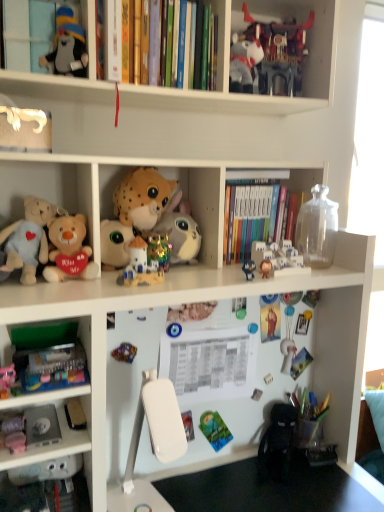
Question: From a real-world perspective, does soft plush toy at center, which is counted as the 1th cabinet, starting from the bottom, stand above soft plush toys at left, the 1th shelf ordered from the bottom?

Choices:
 (A) no
 (B) yes

Answer: (B)

Question: Can you confirm if soft plush toy at center, which is the 1th cabinet in right-to-left order, is shorter than soft plush toys at left, the 1th shelf ordered from the bottom?

Choices:
 (A) yes
 (B) no

Answer: (A)

Question: Is soft plush toy at center, which is counted as the 1th cabinet, starting from the bottom, outside soft plush toys at left, acting as the second shelf starting from the top?

Choices:
 (A) yes
 (B) no

Answer: (A)

Question: Considering the relative sizes of soft plush toy at center, which is counted as the 1th cabinet, starting from the bottom, and soft plush toys at left, the 1th shelf ordered from the bottom, in the image provided, is soft plush toy at center, which is counted as the 1th cabinet, starting from the bottom, taller than soft plush toys at left, the 1th shelf ordered from the bottom,?

Choices:
 (A) no
 (B) yes

Answer: (A)

Question: Can you confirm if soft plush toy at center, which is counted as the 1th cabinet, starting from the bottom, is wider than soft plush toys at left, acting as the second shelf starting from the top?

Choices:
 (A) no
 (B) yes

Answer: (B)

Question: Can you confirm if soft plush toy at center, the 2th cabinet when ordered from top to bottom, is thinner than soft plush toys at left, acting as the second shelf starting from the top?

Choices:
 (A) no
 (B) yes

Answer: (A)

Question: From the image's perspective, is matte pink plush at lower left, marked as the 9th toy in a top-to-bottom arrangement, on top of white plastic castle at upper center, which ranks as the fifth toy in top-to-bottom order?

Choices:
 (A) no
 (B) yes

Answer: (A)

Question: Can you confirm if matte pink plush at lower left, arranged as the 1th toy when ordered from the bottom, is positioned to the left of white plastic castle at upper center, marked as the fifth toy in a bottom-to-top arrangement?

Choices:
 (A) yes
 (B) no

Answer: (A)

Question: Is matte pink plush at lower left, marked as the 9th toy in a top-to-bottom arrangement, facing towards white plastic castle at upper center, marked as the fifth toy in a bottom-to-top arrangement?

Choices:
 (A) yes
 (B) no

Answer: (B)

Question: Does matte pink plush at lower left, marked as the 9th toy in a top-to-bottom arrangement, have a greater width compared to white plastic castle at upper center, marked as the fifth toy in a bottom-to-top arrangement?

Choices:
 (A) no
 (B) yes

Answer: (A)

Question: Considering the relative positions of matte pink plush at lower left, marked as the 9th toy in a top-to-bottom arrangement, and white plastic castle at upper center, marked as the fifth toy in a bottom-to-top arrangement, in the image provided, is matte pink plush at lower left, marked as the 9th toy in a top-to-bottom arrangement, to the right of white plastic castle at upper center, marked as the fifth toy in a bottom-to-top arrangement, from the viewer's perspective?

Choices:
 (A) yes
 (B) no

Answer: (B)

Question: Is white plastic castle at upper center, marked as the fifth toy in a bottom-to-top arrangement, inside matte pink plush at lower left, arranged as the 1th toy when ordered from the bottom?

Choices:
 (A) no
 (B) yes

Answer: (A)

Question: Can you confirm if white plastic table at lower center is positioned to the right of hardcover books at center, arranged as the 1th book when viewed from the back?

Choices:
 (A) no
 (B) yes

Answer: (A)